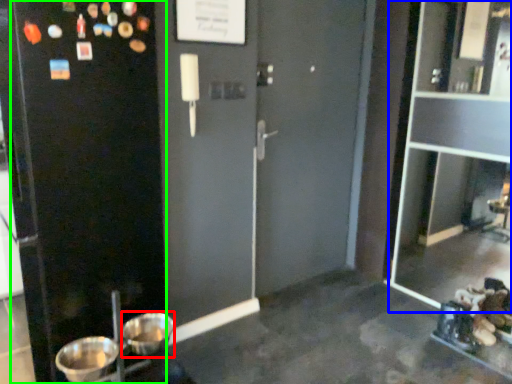
Question: Considering the real-world distances, which object is closest to basin (highlighted by a red box)? glass door (highlighted by a blue box) or screen door (highlighted by a green box).

Choices:
 (A) glass door
 (B) screen door

Answer: (B)